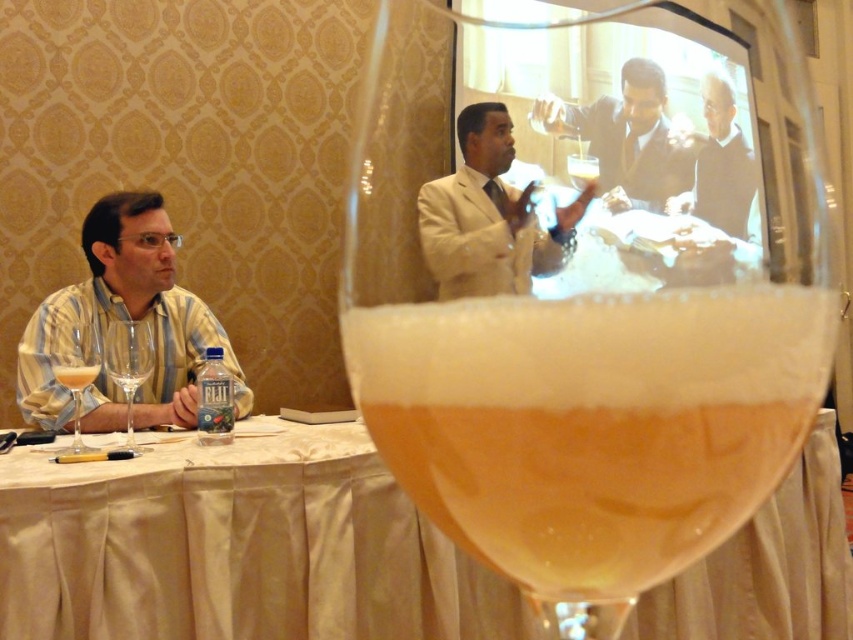
Question: Does smooth beige suit at upper center lie in front of translucent glass wine at left?

Choices:
 (A) yes
 (B) no

Answer: (A)

Question: Does white satin tablecloth at center appear under translucent glass wine at left?

Choices:
 (A) no
 (B) yes

Answer: (B)

Question: Considering the real-world distances, which object is closest to the blue plastic water at lower center?

Choices:
 (A) dark brown leather jacket at upper center
 (B) smooth beige suit at upper center
 (C) translucent glass wine at left
 (D) beige suit at center

Answer: (C)

Question: Which object appears farthest from the camera in this image?

Choices:
 (A) white satin tablecloth at center
 (B) beige suit at center
 (C) translucent glass wine at left
 (D) clear glass wine glass at left

Answer: (D)

Question: Which of the following is the farthest from the observer?

Choices:
 (A) (193, 298)
 (B) (97, 369)

Answer: (A)

Question: Does clear glass wine glass at left have a greater width compared to translucent glass wine at left?

Choices:
 (A) no
 (B) yes

Answer: (A)